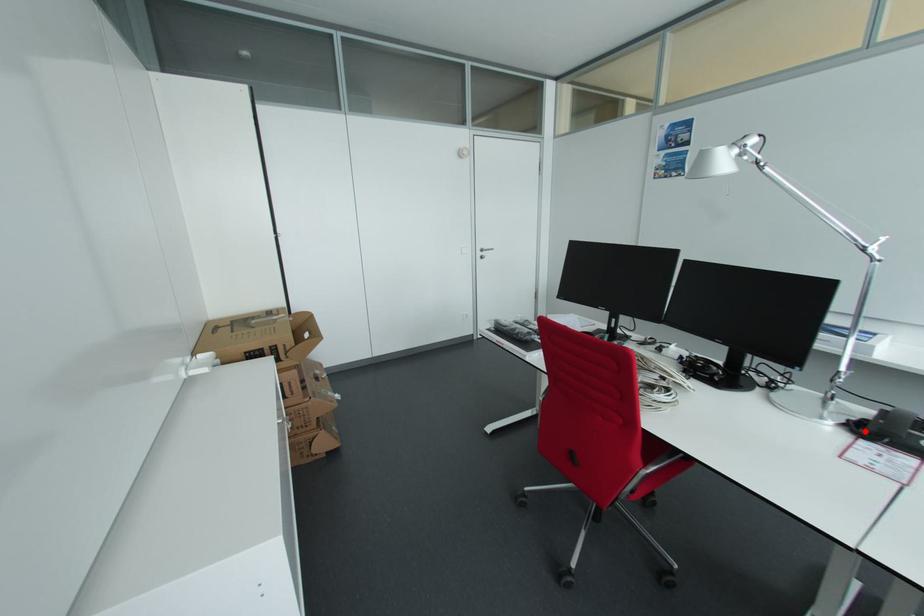
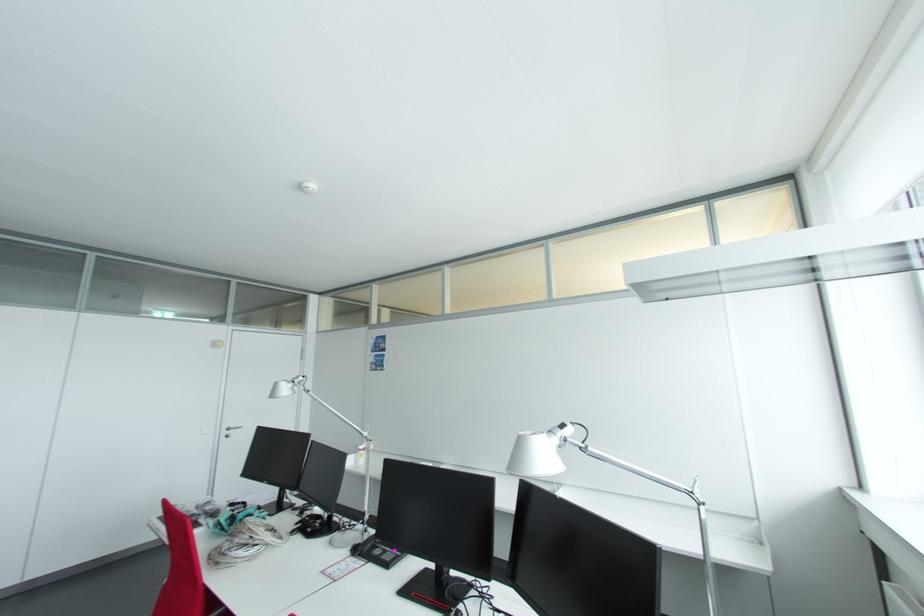
Locate, in the second image, the point that corresponds to the highlighted location in the first image.

(359, 552)